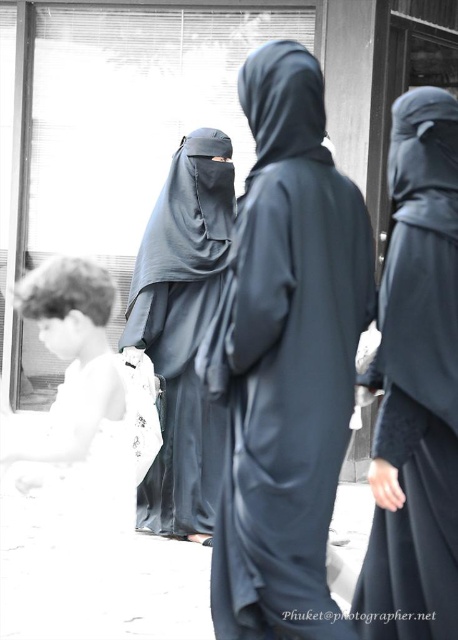
Question: Is transparent glass shop window at center thinner than matte black robe at right?

Choices:
 (A) no
 (B) yes

Answer: (A)

Question: Which object is positioned farthest from the matte black robe at right?

Choices:
 (A) black matte niqab at center
 (B) transparent glass shop window at center

Answer: (B)

Question: Is matte black robe at right positioned in front of dark gray matte niqab at center?

Choices:
 (A) yes
 (B) no

Answer: (A)

Question: Among these points, which one is farthest from the camera?

Choices:
 (A) (265, 442)
 (B) (230, 198)
 (C) (119, 42)
 (D) (456, 140)

Answer: (C)

Question: Considering the relative positions of transparent glass shop window at center and dark gray matte niqab at center in the image provided, where is transparent glass shop window at center located with respect to dark gray matte niqab at center?

Choices:
 (A) above
 (B) below

Answer: (A)

Question: Estimate the real-world distances between objects in this image. Which object is farther from the transparent glass shop window at center?

Choices:
 (A) black matte niqab at center
 (B) matte black robe at right
 (C) dark gray matte niqab at center

Answer: (B)